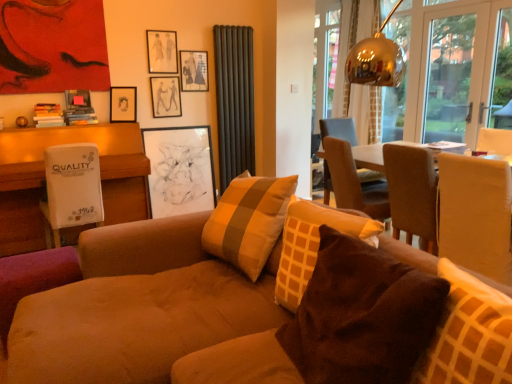
Question: Is dark grey ribbed curtain at upper center, the first curtain in the front-to-back sequence, oriented away from brown fabric chair at upper right, the 1th chair when ordered from back to front?

Choices:
 (A) yes
 (B) no

Answer: (B)

Question: Is the position of dark grey ribbed curtain at upper center, marked as the second curtain in a right-to-left arrangement, less distant than that of brown fabric chair at upper right, the 1th chair when ordered from back to front?

Choices:
 (A) no
 (B) yes

Answer: (A)

Question: From the image's perspective, is dark grey ribbed curtain at upper center, the first curtain in the front-to-back sequence, on top of brown fabric chair at upper right, the 1th chair when ordered from back to front?

Choices:
 (A) no
 (B) yes

Answer: (B)

Question: From a real-world perspective, is dark grey ribbed curtain at upper center, marked as the second curtain in a right-to-left arrangement, on brown fabric chair at upper right, the 1th chair when ordered from back to front?

Choices:
 (A) no
 (B) yes

Answer: (B)

Question: Is dark grey ribbed curtain at upper center, the first curtain in the front-to-back sequence, taller than brown fabric chair at upper right, the 2th chair when ordered from front to back?

Choices:
 (A) no
 (B) yes

Answer: (B)

Question: From a real-world perspective, is dark grey ribbed curtain at upper center, the first curtain in the front-to-back sequence, under brown fabric chair at upper right, the 2th chair when ordered from front to back?

Choices:
 (A) yes
 (B) no

Answer: (B)

Question: From a real-world perspective, does suede couch at center stand above white sheer curtain at upper right, the 1th curtain in the back-to-front sequence?

Choices:
 (A) no
 (B) yes

Answer: (A)

Question: Is suede couch at center closer to the viewer compared to white sheer curtain at upper right, which is the first curtain in right-to-left order?

Choices:
 (A) yes
 (B) no

Answer: (A)

Question: Is suede couch at center facing towards white sheer curtain at upper right, the 1th curtain in the back-to-front sequence?

Choices:
 (A) yes
 (B) no

Answer: (B)

Question: Is suede couch at center positioned with its back to white sheer curtain at upper right, the 1th curtain in the back-to-front sequence?

Choices:
 (A) no
 (B) yes

Answer: (A)

Question: Would you say suede couch at center is outside white sheer curtain at upper right, which is the first curtain in right-to-left order?

Choices:
 (A) no
 (B) yes

Answer: (B)

Question: Is suede couch at center behind white sheer curtain at upper right, the second curtain viewed from the left?

Choices:
 (A) no
 (B) yes

Answer: (A)

Question: Can you confirm if dark grey ribbed curtain at upper center, positioned as the 2th curtain in back-to-front order, is shorter than white cardboard box at left?

Choices:
 (A) no
 (B) yes

Answer: (A)